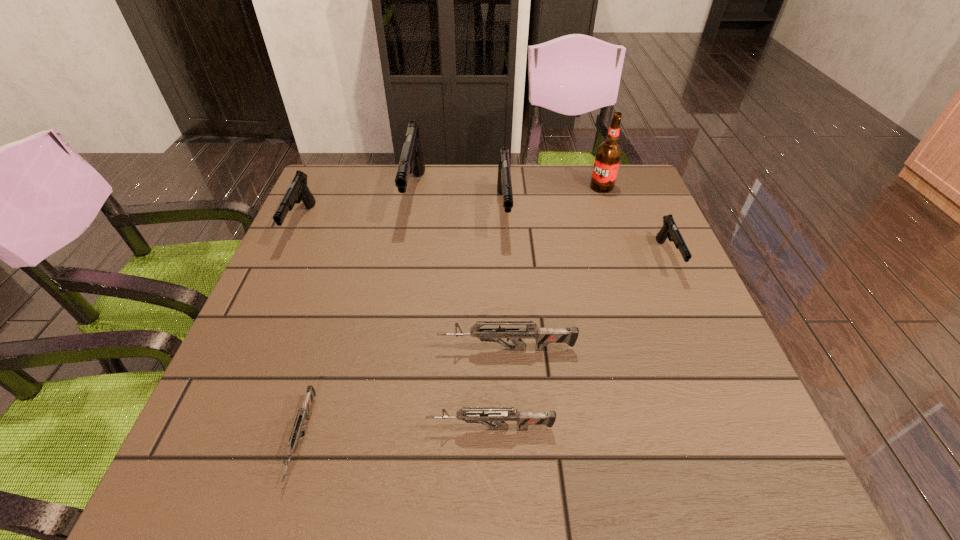
Identify the location of the farthest grey gun. (543, 335).

You are a GUI agent. You are given a task and a screenshot of the screen. Output one action in this format:
    pyautogui.click(x=<x>, y=<y>)
    Task: Click on the third nearest object
    
    Given the screenshot: What is the action you would take?
    pyautogui.click(x=543, y=335)

This screenshot has height=540, width=960. I want to click on the seventh tallest object, so click(524, 418).

The width and height of the screenshot is (960, 540). What are the coordinates of `the second biggest grey gun` in the screenshot? It's located at (524, 418).

What are the coordinates of `the sixth gun from right to left` in the screenshot? It's located at (298, 426).

Where is `the shortest object`? the shortest object is located at coordinates (298, 426).

Image resolution: width=960 pixels, height=540 pixels. Find the location of `free spot located 0.050m on the left of the tallest object`. free spot located 0.050m on the left of the tallest object is located at coordinates (573, 187).

This screenshot has width=960, height=540. I want to click on free space located 0.240m at the aiming end of the biggest black gun, so click(x=396, y=302).

I want to click on blank space located at the aiming end of the third smallest black gun, so click(508, 267).

In order to click on vacant point located at the aiming end of the leftmost object in this screenshot , I will do `click(266, 303)`.